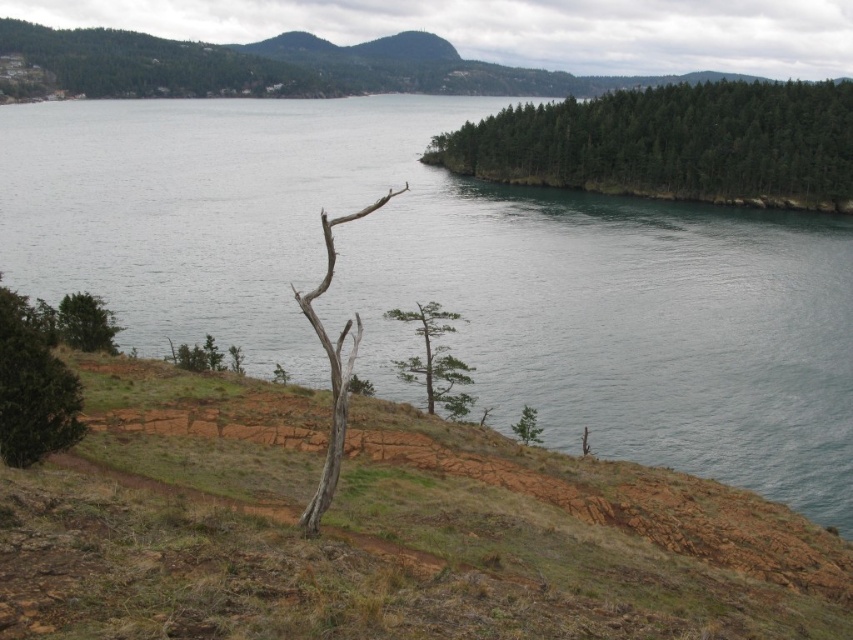
You are standing at the rugged, reddish brown cliff face in the foreground of the scene. You want to walk towards the green matte bush at left located at point (33, 388). Is there any obstacle between you and the green matte bush at left?

There is no obstacle between you and the green matte bush at left at point (33, 388) because the scene description mentions sparse vegetation and the foreground is dominated by the cliff face, implying a clear path.

You are standing on the rugged cliff face and want to walk to the green matte tree at center. Which direction should you move relative to the green matte bush at left?

You should move to the right of the green matte bush at left to reach the green matte tree at center because the green matte bush at left is positioned to the left of the green matte tree at center.